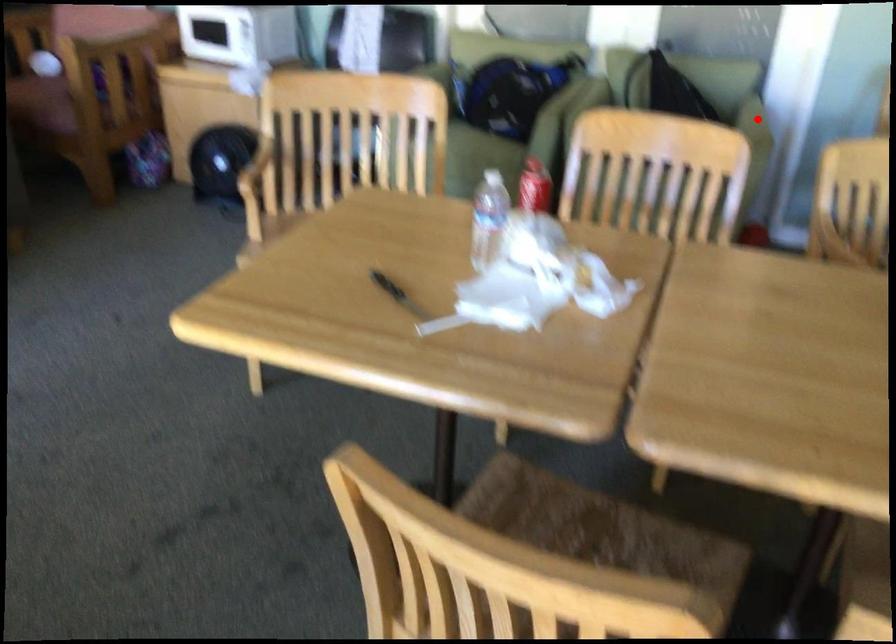
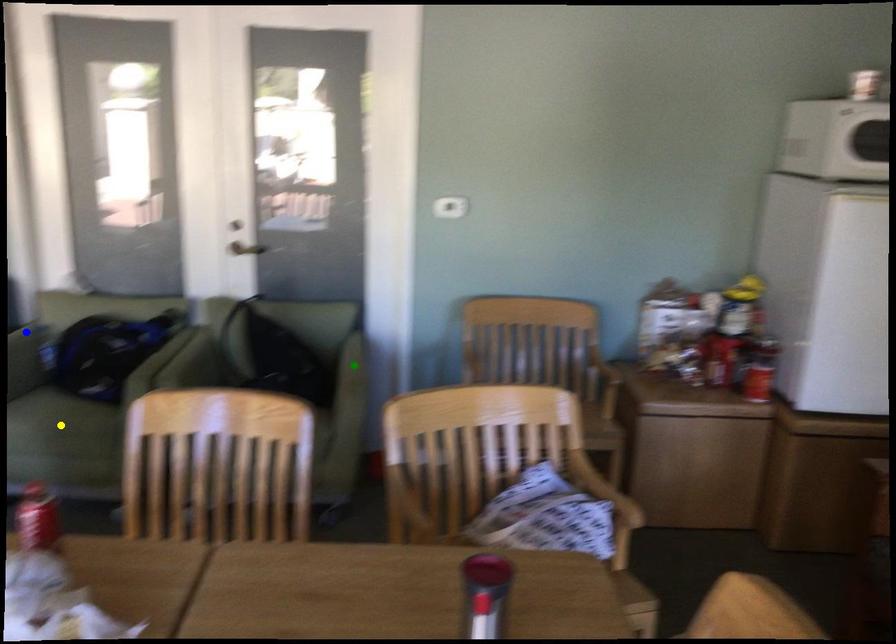
Question: I am providing you with two images of the same scene from different viewpoints. A red point is marked on the first image. You are given multiple points on the second image. In image 2, which mark is for the same physical point as the one in image 1?

Choices:
 (A) green point
 (B) blue point
 (C) yellow point

Answer: (A)